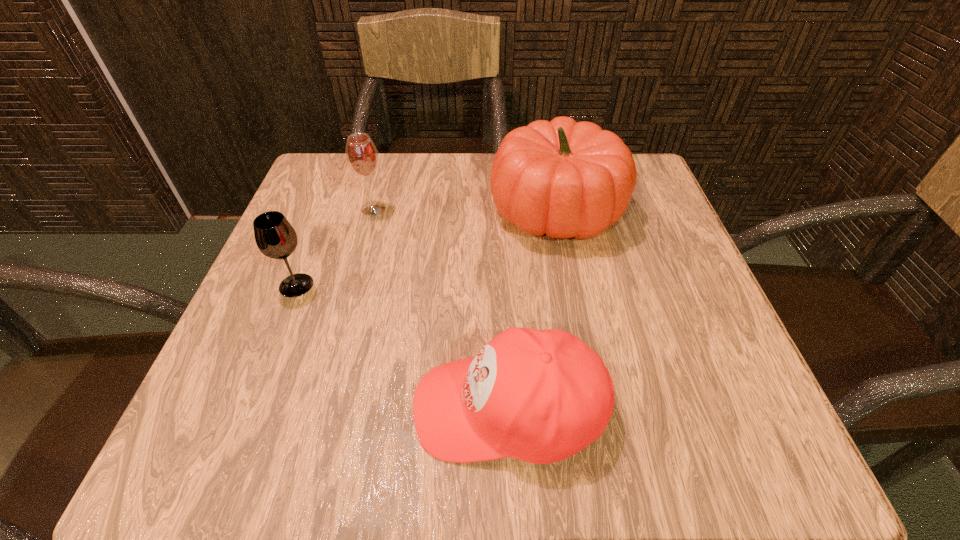
Locate an element on the screen. The image size is (960, 540). pumpkin is located at coordinates (567, 179).

You are a GUI agent. You are given a task and a screenshot of the screen. Output one action in this format:
    pyautogui.click(x=<x>, y=<y>)
    Task: Click on the farther wineglass
    Image resolution: width=960 pixels, height=540 pixels.
    Given the screenshot: What is the action you would take?
    pyautogui.click(x=361, y=154)

You are a GUI agent. You are given a task and a screenshot of the screen. Output one action in this format:
    pyautogui.click(x=<x>, y=<y>)
    Task: Click on the second object from left to right
    This screenshot has width=960, height=540.
    Given the screenshot: What is the action you would take?
    pyautogui.click(x=361, y=154)

Locate an element on the screen. The width and height of the screenshot is (960, 540). the third farthest object is located at coordinates (275, 237).

This screenshot has width=960, height=540. I want to click on the left wineglass, so click(275, 237).

Locate an element on the screen. This screenshot has width=960, height=540. baseball cap is located at coordinates (540, 396).

Identify the location of free point located 0.240m on the front of the pumpkin. (588, 367).

Find the location of a particular element. The width and height of the screenshot is (960, 540). free region located 0.140m on the front of the right wineglass is located at coordinates (357, 267).

You are a GUI agent. You are given a task and a screenshot of the screen. Output one action in this format:
    pyautogui.click(x=<x>, y=<y>)
    Task: Click on the free space located 0.270m on the back of the nearer wineglass
    Image resolution: width=960 pixels, height=540 pixels.
    Given the screenshot: What is the action you would take?
    pyautogui.click(x=336, y=185)

At what (x,y) coordinates should I click in order to perform the action: click on free location located 0.080m on the front panel of the baseball cap. Please return your answer as a coordinate pair (x, y). Image resolution: width=960 pixels, height=540 pixels. Looking at the image, I should click on (356, 408).